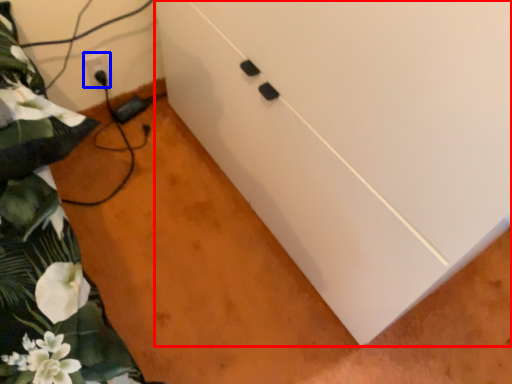
Question: Which point is further to the camera, cabinetry (highlighted by a red box) or electric outlet (highlighted by a blue box)?

Choices:
 (A) cabinetry
 (B) electric outlet

Answer: (B)